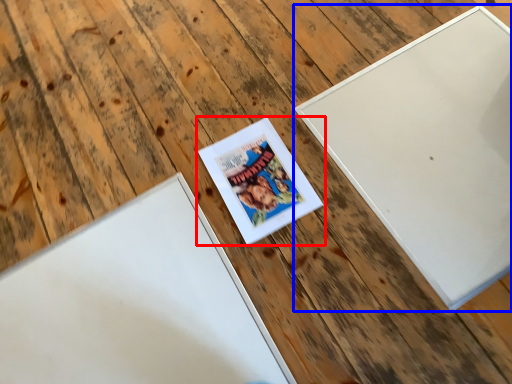
Question: Which point is further to the camera, picture frame (highlighted by a red box) or picture frame (highlighted by a blue box)?

Choices:
 (A) picture frame
 (B) picture frame

Answer: (A)